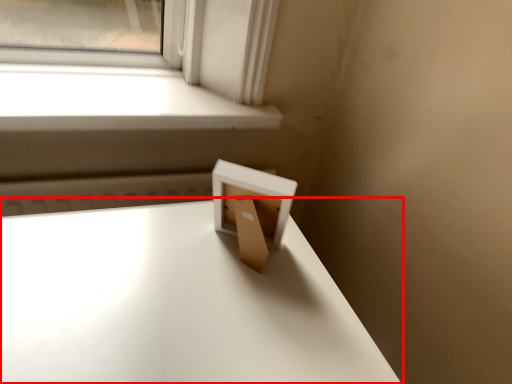
Question: From the image's perspective, where is table (annotated by the red box) located relative to window?

Choices:
 (A) above
 (B) below

Answer: (B)